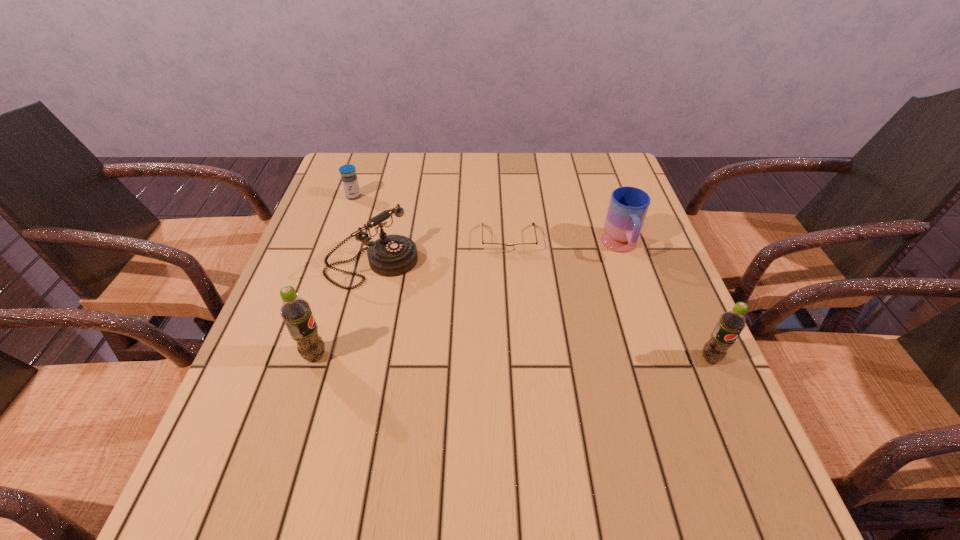
In order to click on free space between the fourth object from left to right and the shorter soda in this screenshot , I will do `click(610, 299)`.

Locate an element on the screen. vacant space in between the fifth object from left to right and the telephone is located at coordinates (496, 255).

Locate an element on the screen. This screenshot has width=960, height=540. vacant area that lies between the third object from right to left and the mug is located at coordinates (564, 243).

Find the location of a particular element. This screenshot has height=540, width=960. vacant area that lies between the shortest object and the fifth tallest object is located at coordinates (431, 218).

The width and height of the screenshot is (960, 540). I want to click on free space between the shorter soda and the tallest object, so 513,357.

Locate an element on the screen. The width and height of the screenshot is (960, 540). vacant area that lies between the shortest object and the mug is located at coordinates (564, 243).

The height and width of the screenshot is (540, 960). Identify the location of free spot between the fourth object from left to right and the farthest object. (431, 218).

Identify the location of vacant point located between the rightmost object and the left soda. (513, 357).

Where is `object that is the fourth closest one to the taller soda`? The width and height of the screenshot is (960, 540). object that is the fourth closest one to the taller soda is located at coordinates (628, 206).

Locate which object is the closest to the tallest object. Please provide its 2D coordinates. Your answer should be formatted as a tuple, i.e. [(x, y)], where the tuple contains the x and y coordinates of a point satisfying the conditions above.

[(393, 255)]